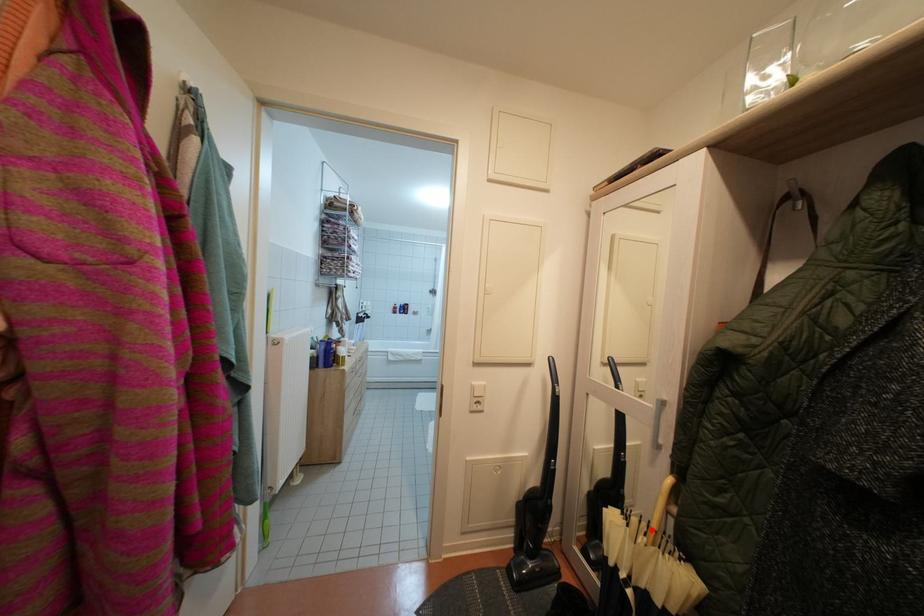
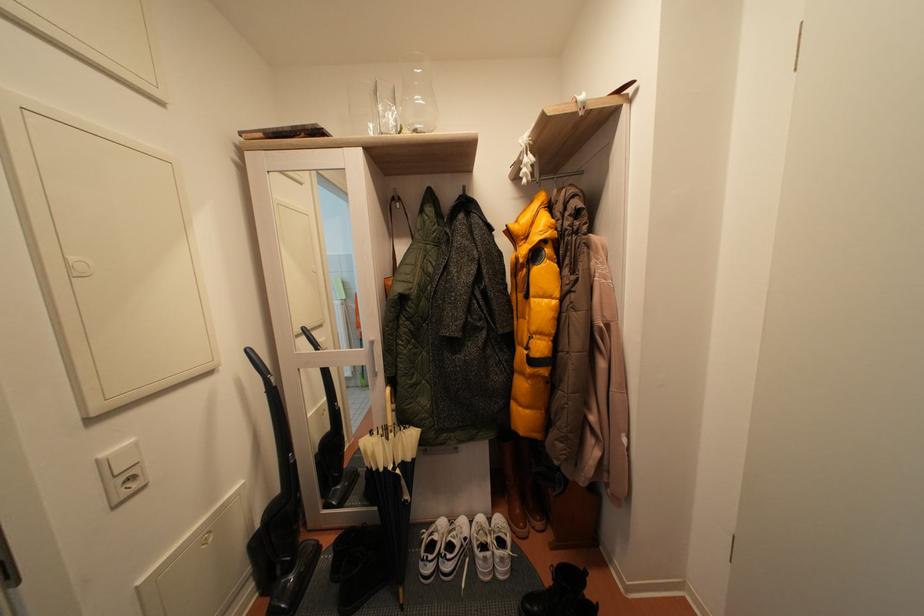
The point at the highlighted location is marked in the first image. Where is the corresponding point in the second image?

(387, 437)